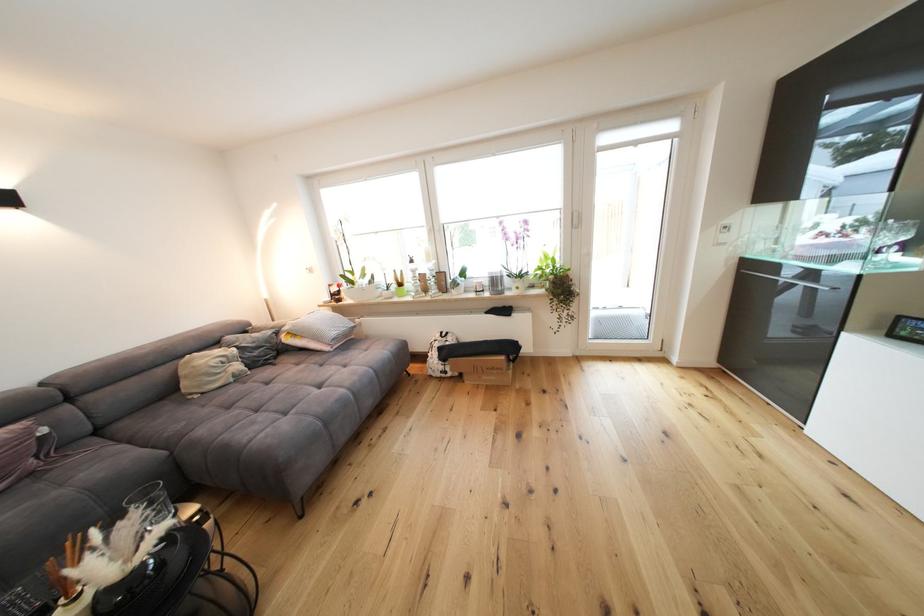
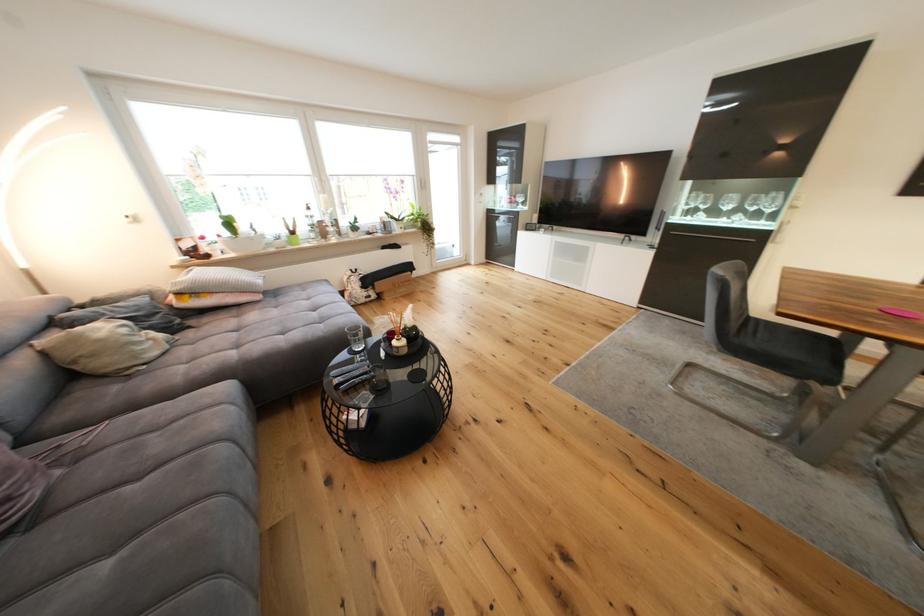
Locate, in the second image, the point that corresponds to point 245,369 in the first image.

(161, 336)